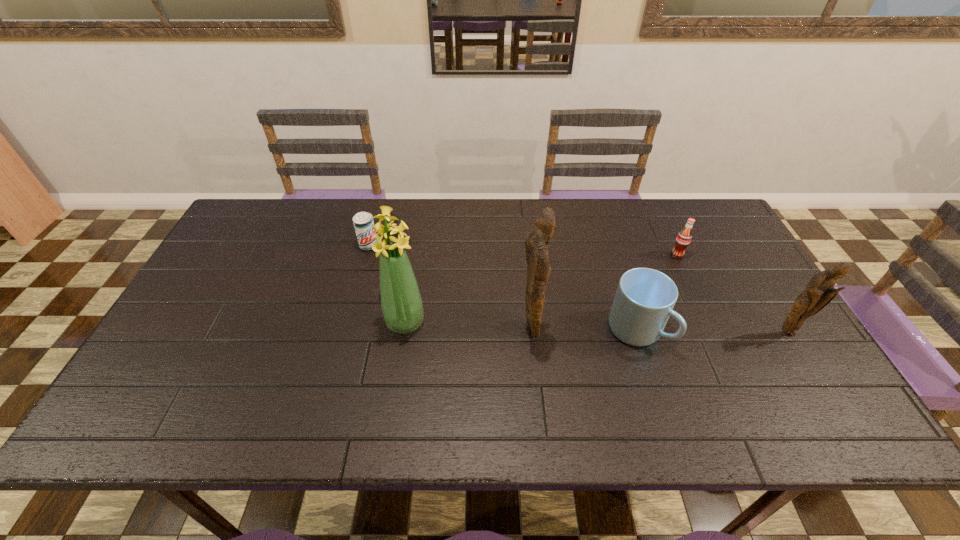
Locate an element on the screen. This screenshot has height=540, width=960. vacant space at the right edge of the desktop is located at coordinates (755, 333).

Locate an element on the screen. The height and width of the screenshot is (540, 960). vacant space at the far right corner is located at coordinates (734, 242).

Where is `vacant space at the near right corner of the desktop`? The width and height of the screenshot is (960, 540). vacant space at the near right corner of the desktop is located at coordinates (758, 379).

At what (x,y) coordinates should I click in order to perform the action: click on free spot between the rightmost object and the fourth object from left to right. Please return your answer as a coordinate pair (x, y). Image resolution: width=960 pixels, height=540 pixels. Looking at the image, I should click on coord(712,331).

At what (x,y) coordinates should I click in order to perform the action: click on free space between the bouquet and the left figurine. Please return your answer as a coordinate pair (x, y). Looking at the image, I should click on (468, 327).

Where is `vacant region between the leftmost object and the taller figurine`? This screenshot has height=540, width=960. vacant region between the leftmost object and the taller figurine is located at coordinates (449, 288).

The image size is (960, 540). Find the location of `unoccupied position between the soda and the shortest object`. unoccupied position between the soda and the shortest object is located at coordinates (523, 251).

You are a GUI agent. You are given a task and a screenshot of the screen. Output one action in this format:
    pyautogui.click(x=<x>, y=<y>)
    Task: Click on the blank region between the bouquet and the left figurine
    
    Given the screenshot: What is the action you would take?
    pyautogui.click(x=468, y=327)

At what (x,y) coordinates should I click in order to perform the action: click on free spot between the mug and the leftmost object. Please return your answer as a coordinate pair (x, y). This screenshot has height=540, width=960. Looking at the image, I should click on (503, 288).

Find the location of a particular element. The image size is (960, 540). object that is the third nearest to the left figurine is located at coordinates (683, 239).